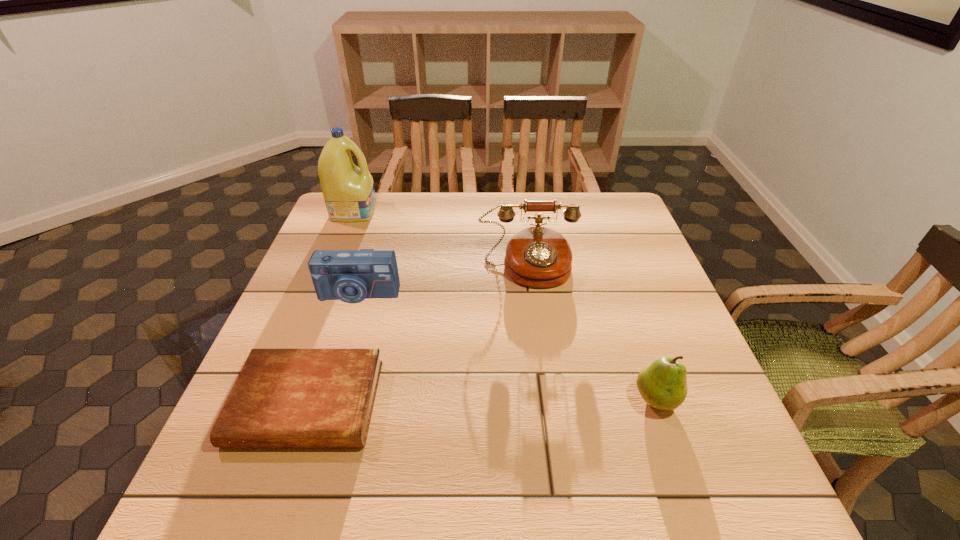
The image size is (960, 540). Find the location of `the farthest object`. the farthest object is located at coordinates (349, 194).

Identify the location of detergent. (349, 194).

The height and width of the screenshot is (540, 960). In order to click on telephone in this screenshot , I will do `click(539, 257)`.

The image size is (960, 540). Identify the location of the second object from right to left. (539, 257).

I want to click on pear, so click(662, 384).

Locate an element on the screen. The image size is (960, 540). camera is located at coordinates pyautogui.click(x=351, y=276).

The height and width of the screenshot is (540, 960). I want to click on the shortest object, so click(x=282, y=397).

This screenshot has height=540, width=960. Find the location of `free region located 0.280m on the label of the detergent`. free region located 0.280m on the label of the detergent is located at coordinates (465, 211).

At what (x,y) coordinates should I click in order to perform the action: click on free space located on the dial of the second tallest object. Please return your answer as a coordinate pair (x, y). The height and width of the screenshot is (540, 960). Looking at the image, I should click on (535, 319).

Locate an element on the screen. free location located on the left of the rightmost object is located at coordinates (532, 399).